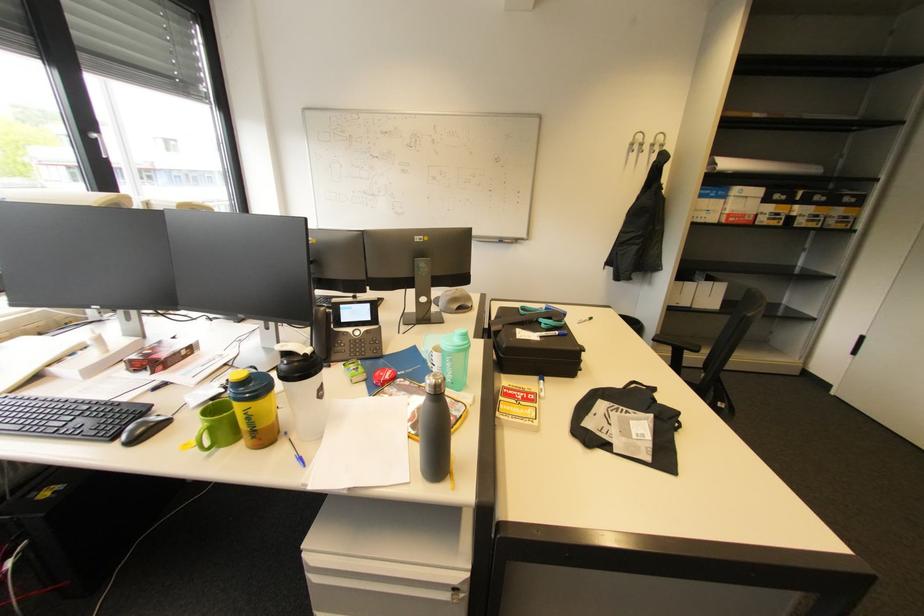
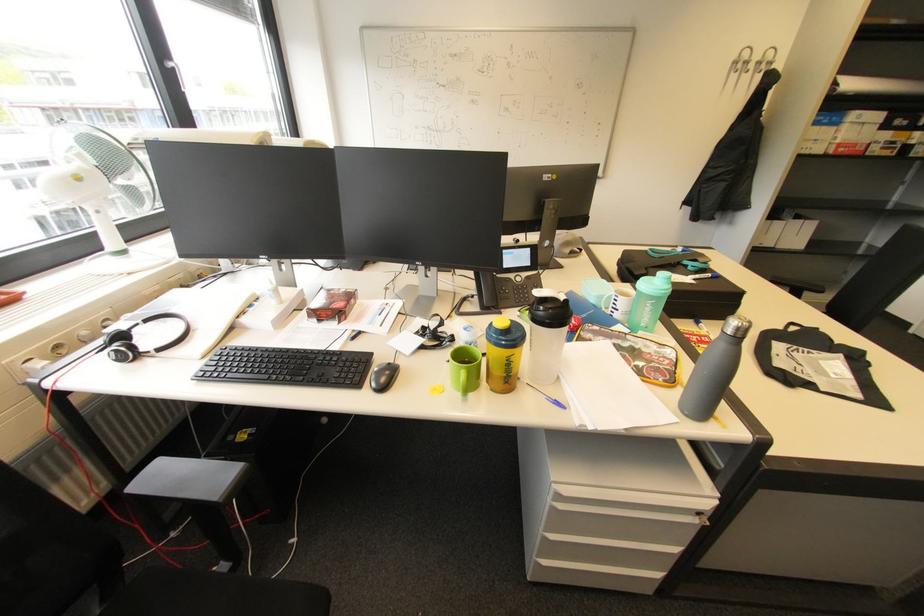
The point at [140,442] is marked in the first image. Where is the corresponding point in the second image?

(387, 389)